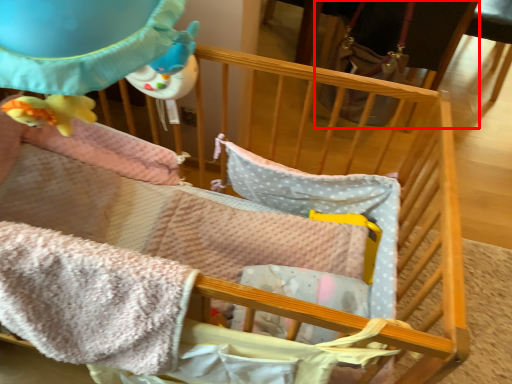
Question: From the image's perspective, considering the relative positions of feeding chair (annotated by the red box) and blanket in the image provided, where is feeding chair (annotated by the red box) located with respect to the staircase?

Choices:
 (A) above
 (B) below

Answer: (A)